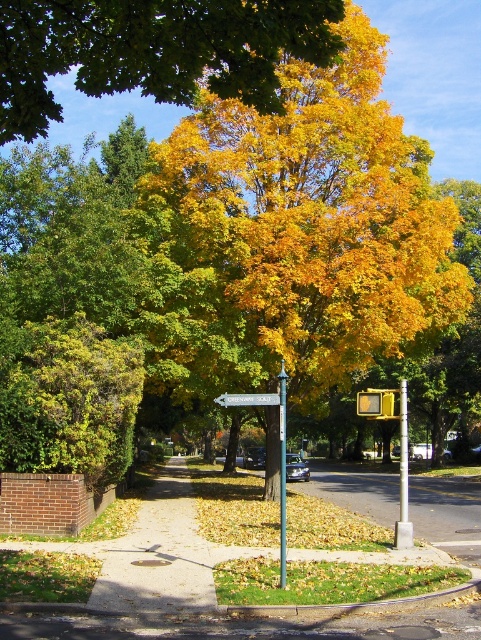
Who is lower down, metallic pole at center or white plastic signpost at center?

metallic pole at center is lower down.

Is metallic pole at center to the left of white plastic signpost at center from the viewer's perspective?

Incorrect, metallic pole at center is not on the left side of white plastic signpost at center.

Is point (282, 477) closer to camera compared to point (241, 401)?

Yes, point (282, 477) is closer to viewer.

Image resolution: width=481 pixels, height=640 pixels. I want to click on metallic pole at center, so click(282, 474).

Is metallic gray pole at center-right in front of metallic pole at center?

No, metallic gray pole at center-right is behind metallic pole at center.

Who is more forward, (x=403, y=547) or (x=281, y=435)?

Point (x=281, y=435)

Locate an element on the screen. metallic gray pole at center-right is located at coordinates (404, 476).

Which is below, golden yellow leaves at upper center or metallic pole at center?

metallic pole at center

The image size is (481, 640). What do you see at coordinates (151, 51) in the screenshot? I see `golden yellow leaves at upper center` at bounding box center [151, 51].

Locate an element on the screen. The width and height of the screenshot is (481, 640). golden yellow leaves at upper center is located at coordinates (151, 51).